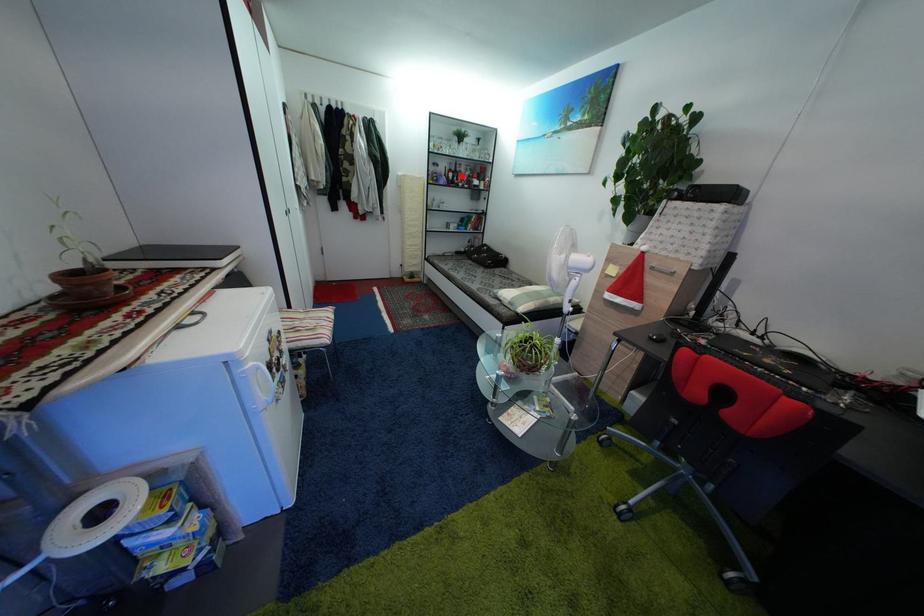
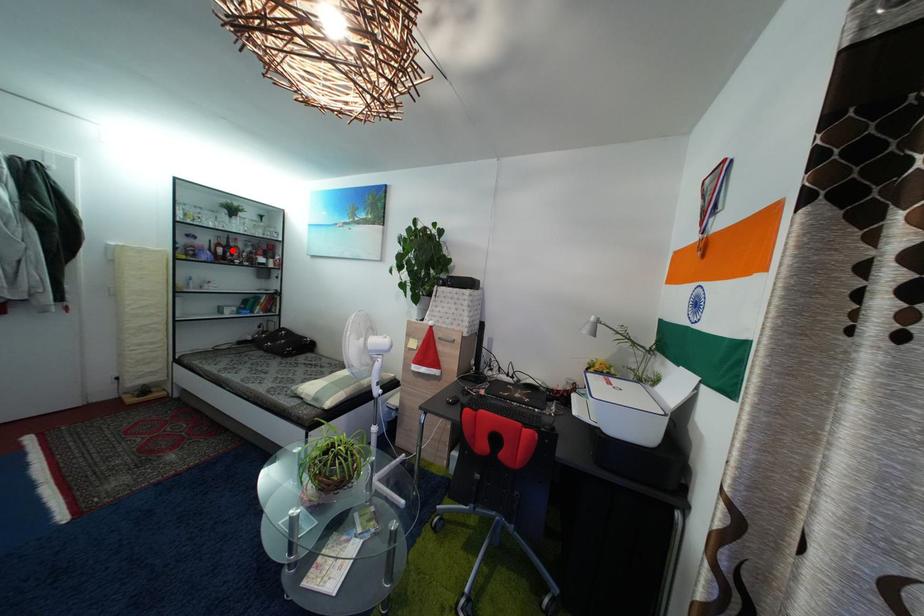
I am providing you with two images of the same scene from different viewpoints. A red point is marked on the first image and another point is marked on the second image. Do the highlighted points in image1 and image2 indicate the same real-world spot?

Yes